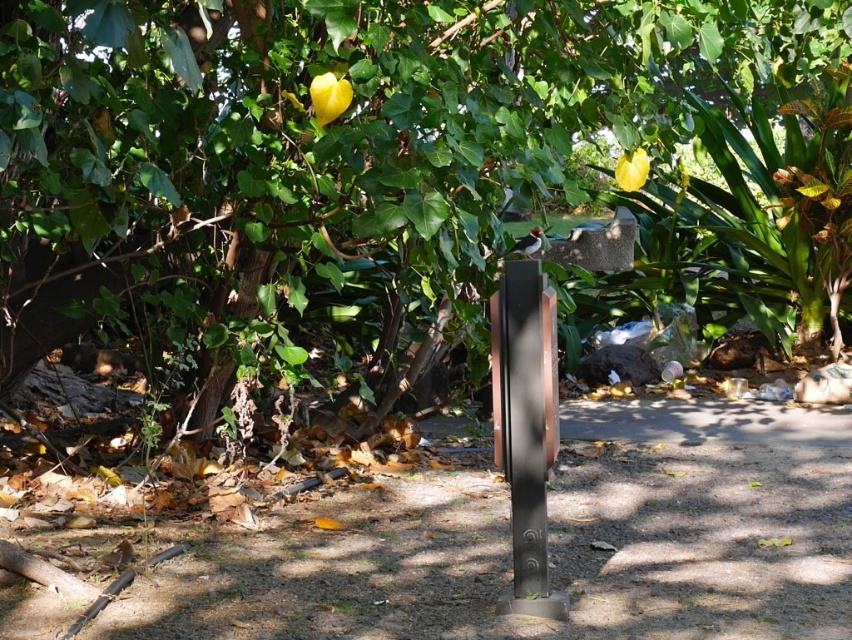
Question: Which object is farther from the camera taking this photo?

Choices:
 (A) metallic gray post at center
 (B) green leafy tree at center

Answer: (A)

Question: Where is green leafy tree at center located in relation to metallic gray post at center in the image?

Choices:
 (A) above
 (B) below

Answer: (A)

Question: Which of the following is the closest to the observer?

Choices:
 (A) metallic gray post at center
 (B) green leafy tree at center

Answer: (B)

Question: Among these objects, which one is nearest to the camera?

Choices:
 (A) metallic gray post at center
 (B) green leafy tree at center

Answer: (B)

Question: Is green leafy tree at center below metallic gray post at center?

Choices:
 (A) no
 (B) yes

Answer: (A)

Question: Is green leafy tree at center above metallic gray post at center?

Choices:
 (A) no
 (B) yes

Answer: (B)